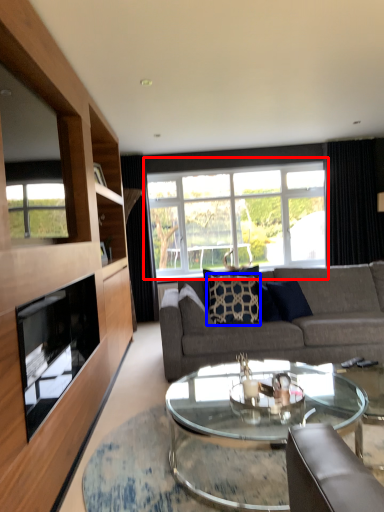
Question: Which object appears closest to the camera in this image, window (highlighted by a red box) or pillow (highlighted by a blue box)?

Choices:
 (A) window
 (B) pillow

Answer: (B)